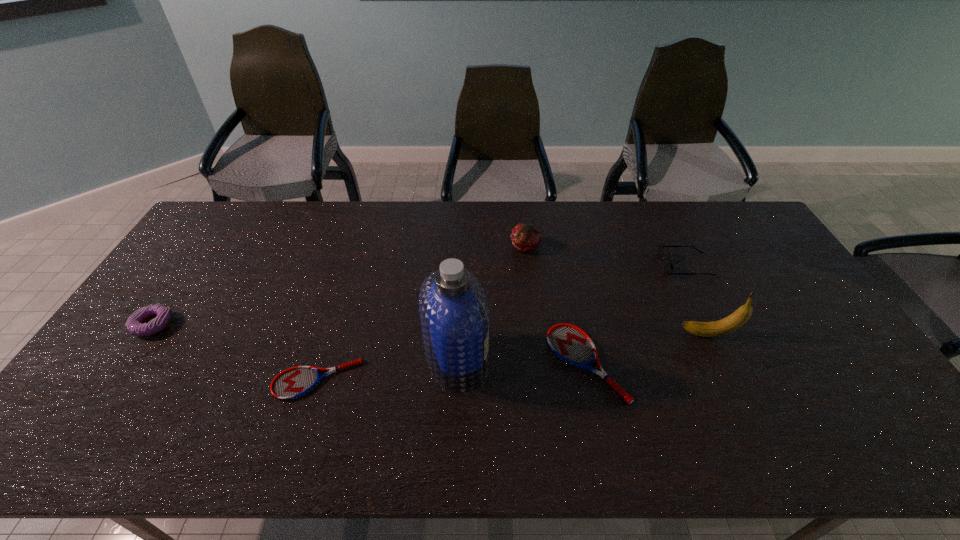
Image resolution: width=960 pixels, height=540 pixels. In order to click on vacant region between the leftmost object and the third object from left to right in this screenshot , I will do `click(305, 342)`.

Image resolution: width=960 pixels, height=540 pixels. I want to click on vacant area that lies between the leftmost object and the tallest object, so click(305, 342).

The height and width of the screenshot is (540, 960). Find the location of `free space between the right tennis racket and the third shortest object`. free space between the right tennis racket and the third shortest object is located at coordinates (370, 344).

Locate an element on the screen. The image size is (960, 540). free space between the sixth tallest object and the tomato is located at coordinates (556, 305).

This screenshot has height=540, width=960. Find the location of `vacant area that lies between the sunglasses and the tallest object`. vacant area that lies between the sunglasses and the tallest object is located at coordinates (571, 313).

Where is `vacant point located between the sunglasses and the fifth shortest object`? The width and height of the screenshot is (960, 540). vacant point located between the sunglasses and the fifth shortest object is located at coordinates (605, 256).

I want to click on vacant space that is in between the tomato and the second tallest object, so click(617, 291).

Where is `unoccupied position between the sunglasses and the sixth shortest object`? This screenshot has width=960, height=540. unoccupied position between the sunglasses and the sixth shortest object is located at coordinates (697, 300).

You are a GUI agent. You are given a task and a screenshot of the screen. Output one action in this format:
    pyautogui.click(x=<x>, y=<y>)
    Task: Click on the unoccupied position between the shorter tennis racket and the doughnut
    The height and width of the screenshot is (540, 960).
    Given the screenshot: What is the action you would take?
    pyautogui.click(x=235, y=352)

Identify the location of object that stands as the fifth closest to the sunglasses. The image size is (960, 540). (292, 383).